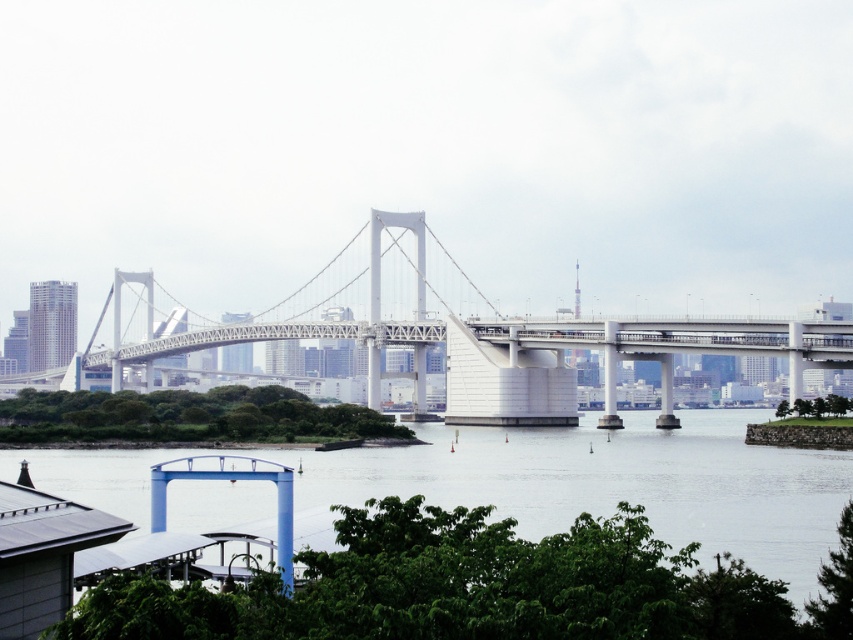
Question: Which point is farther to the camera?

Choices:
 (A) (606, 364)
 (B) (225, 500)

Answer: (A)

Question: Among these objects, which one is farthest from the camera?

Choices:
 (A) transparent water at lower center
 (B) white metallic suspension bridge at center

Answer: (B)

Question: Can you confirm if transparent water at lower center is thinner than white metallic suspension bridge at center?

Choices:
 (A) no
 (B) yes

Answer: (B)

Question: Does transparent water at lower center appear on the right side of white metallic suspension bridge at center?

Choices:
 (A) yes
 (B) no

Answer: (A)

Question: Can you confirm if transparent water at lower center is positioned above white metallic suspension bridge at center?

Choices:
 (A) yes
 (B) no

Answer: (B)